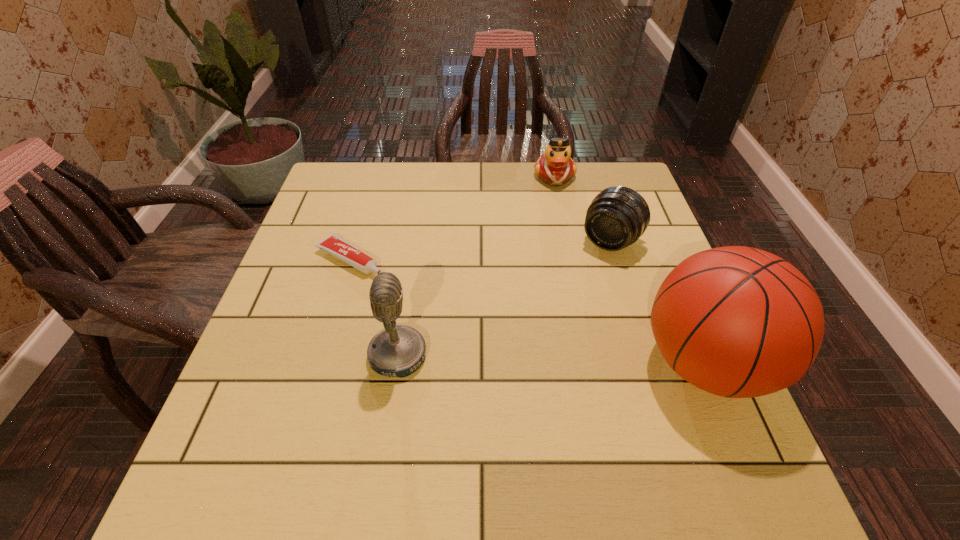
Where is `free space on the desktop that is between the fourth shortest object and the basketball and is positioned at the nozzle of the leftmost object`? free space on the desktop that is between the fourth shortest object and the basketball and is positioned at the nozzle of the leftmost object is located at coordinates (515, 359).

Identify the location of free space on the desktop that is between the fourth object from right to left and the basketball and is positioned at the front element of the telephoto lens. This screenshot has height=540, width=960. (524, 359).

In order to click on vacant space on the desktop that is between the microphone and the tallest object and is positioned on the face of the duck in this screenshot , I will do `click(593, 360)`.